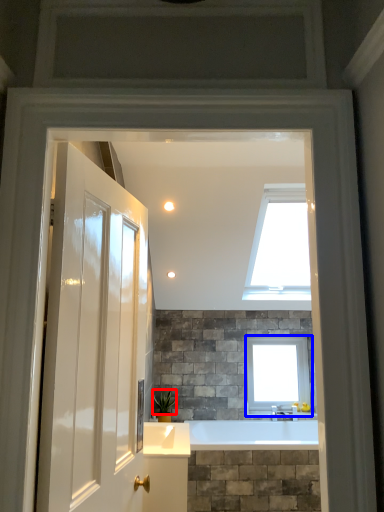
Question: Which of the following is the farthest to the observer, plant (highlighted by a red box) or window (highlighted by a blue box)?

Choices:
 (A) plant
 (B) window

Answer: (B)